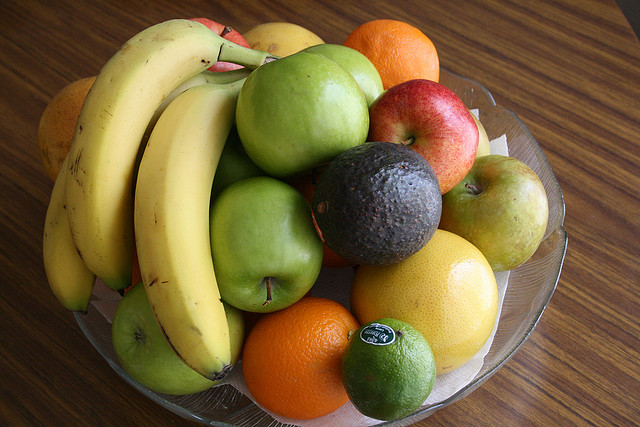
Find the location of a particular element. This screenshot has height=427, width=640. paper towel is located at coordinates (447, 378).